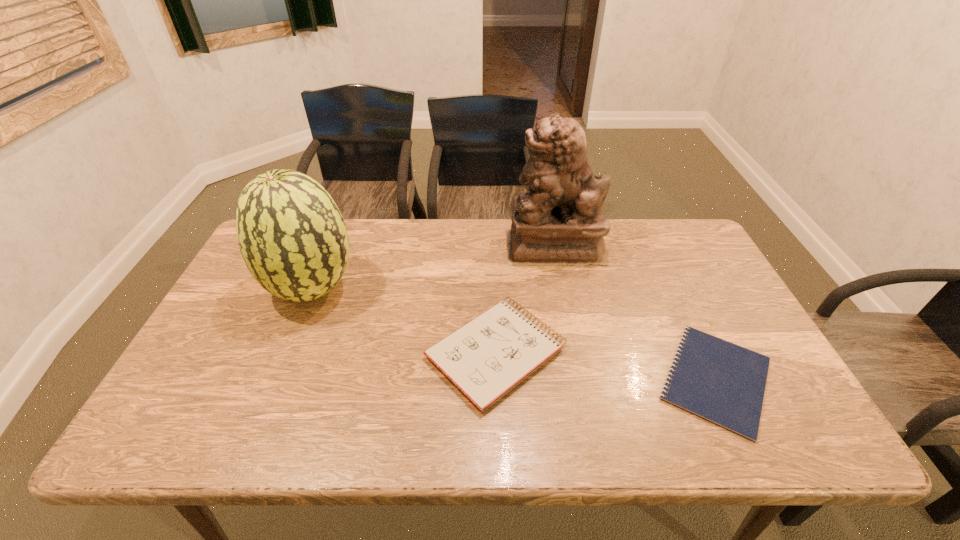
Where is `object that stands as the closest to the sculpture`? Image resolution: width=960 pixels, height=540 pixels. object that stands as the closest to the sculpture is located at coordinates (487, 357).

Identify which object is the second closest to the rightmost object. Please provide its 2D coordinates. Your answer should be formatted as a tuple, i.e. [(x, y)], where the tuple contains the x and y coordinates of a point satisfying the conditions above.

[(559, 221)]

At what (x,y) coordinates should I click in order to perform the action: click on vacant space that satisfies the following two spatial constraints: 1. on the front-facing side of the shortest object; 2. on the left side of the sculpture. Please return your answer as a coordinate pair (x, y). Looking at the image, I should click on (581, 379).

You are a GUI agent. You are given a task and a screenshot of the screen. Output one action in this format:
    pyautogui.click(x=<x>, y=<y>)
    Task: Click on the vacant space that satisfies the following two spatial constraints: 1. on the front-facing side of the sculpture; 2. on the right side of the right notepad
    The width and height of the screenshot is (960, 540).
    Given the screenshot: What is the action you would take?
    pyautogui.click(x=581, y=379)

Identify the location of free space that satisfies the following two spatial constraints: 1. on the front-facing side of the shorter notepad; 2. on the left side of the sculpture. The height and width of the screenshot is (540, 960). click(x=581, y=379).

Find the location of a particular element. The width and height of the screenshot is (960, 540). vacant region that satisfies the following two spatial constraints: 1. on the front-facing side of the sculpture; 2. on the left side of the shorter notepad is located at coordinates (581, 379).

This screenshot has width=960, height=540. I want to click on free space in the image that satisfies the following two spatial constraints: 1. on the front-facing side of the sculpture; 2. on the front side of the left notepad, so 575,353.